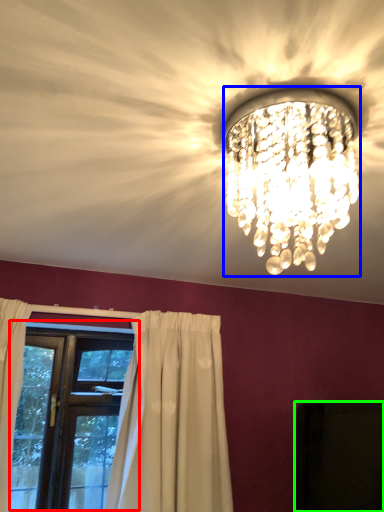
Question: Based on their relative distances, which object is farther from window (highlighted by a red box)? Choose from lamp (highlighted by a blue box) and dark (highlighted by a green box).

Choices:
 (A) lamp
 (B) dark

Answer: (A)